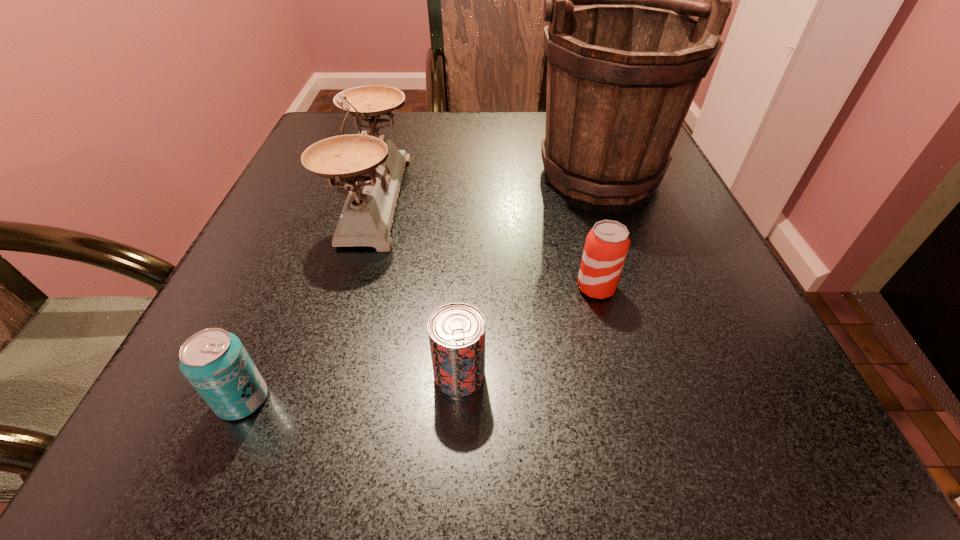
Identify the location of object that is at the near left corner. (214, 361).

The width and height of the screenshot is (960, 540). In order to click on object that is at the far right corner in this screenshot , I will do `click(622, 73)`.

What are the coordinates of `free region at the far edge of the desktop` in the screenshot? It's located at (460, 119).

Where is `free space at the near edge of the desktop`? The height and width of the screenshot is (540, 960). free space at the near edge of the desktop is located at coordinates (292, 433).

Where is `free point at the left edge`? free point at the left edge is located at coordinates (x=316, y=204).

The width and height of the screenshot is (960, 540). In the image, there is a desktop. Find the location of `free region at the right edge`. free region at the right edge is located at coordinates (730, 352).

Identify the location of blank space at the near left corner of the desktop. (168, 456).

The image size is (960, 540). Find the location of `free space between the second tallest object and the farthest beer can`. free space between the second tallest object and the farthest beer can is located at coordinates (485, 242).

Image resolution: width=960 pixels, height=540 pixels. In order to click on vacant space that is in between the third nearest object and the tallest object in this screenshot , I will do `click(595, 222)`.

This screenshot has height=540, width=960. In order to click on blank region between the tallest object and the leftmost beer can in this screenshot , I will do `click(419, 278)`.